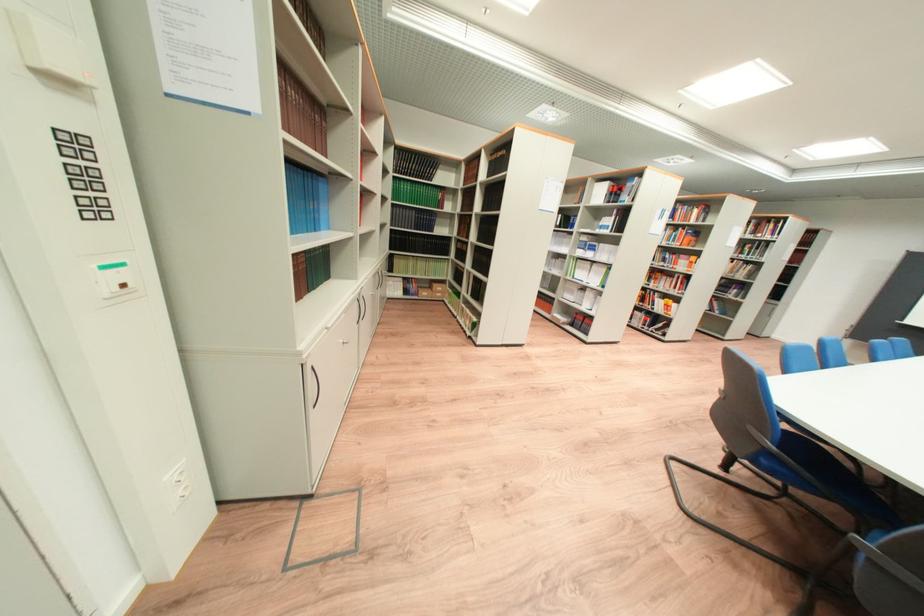
Describe the element at coordinates (178, 484) in the screenshot. I see `the white electrical outlet` at that location.